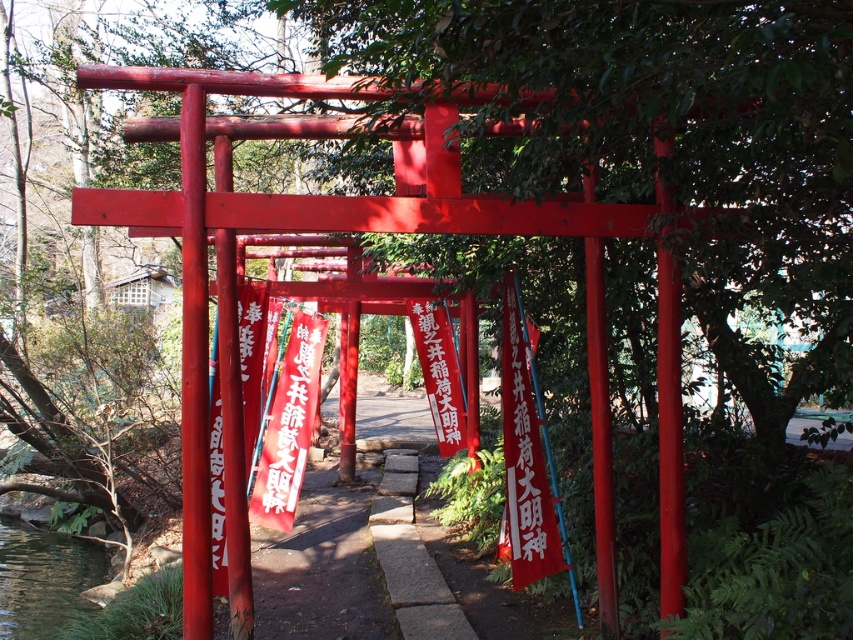
You are standing in front of the torii gate and want to place a small statue on the ground. The statue requires a flat surface that is lower than the red paper banner at center. Can you place it on the clear water at lower left?

The clear water at lower left is not as tall as the red paper banner at center, so yes, you can place the statue on the clear water at lower left since it is lower than the red paper banner at center.

You are standing in front of the torii gate and want to place a small offering. The clear water at lower left and the red paper banner at center are in your view. Which object is located lower in the image?

The clear water at lower left is located below the red paper banner at center, so it is positioned lower in the image.